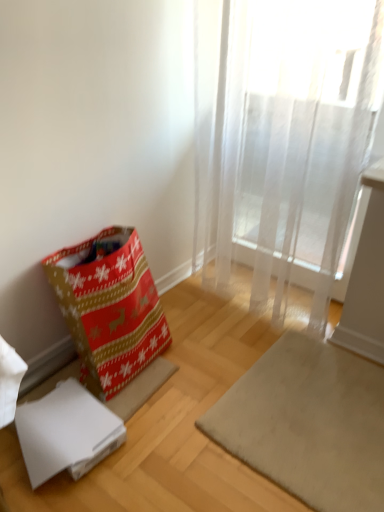
Question: Visually, is translucent white curtain at upper right positioned to the left or to the right of christmas-patterned fabric gift bag at lower left?

Choices:
 (A) left
 (B) right

Answer: (B)

Question: Is translucent white curtain at upper right inside the boundaries of christmas-patterned fabric gift bag at lower left, or outside?

Choices:
 (A) inside
 (B) outside

Answer: (B)

Question: Which of these objects is positioned farthest from the white cardboard box at lower left?

Choices:
 (A) beige carpet at lower center
 (B) translucent white curtain at upper right
 (C) christmas-patterned fabric gift bag at lower left

Answer: (B)

Question: Estimate the real-world distances between objects in this image. Which object is closer to the christmas-patterned fabric gift bag at lower left?

Choices:
 (A) white cardboard box at lower left
 (B) beige carpet at lower center
 (C) translucent white curtain at upper right

Answer: (A)